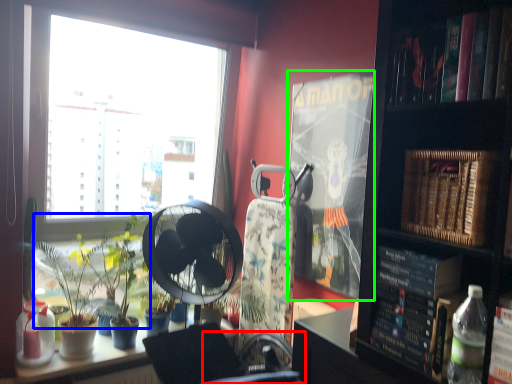
Question: Which object is positioned farthest from swivel chair (highlighted by a red box)? Select from plant (highlighted by a blue box) and paperback book (highlighted by a green box).

Choices:
 (A) plant
 (B) paperback book

Answer: (B)